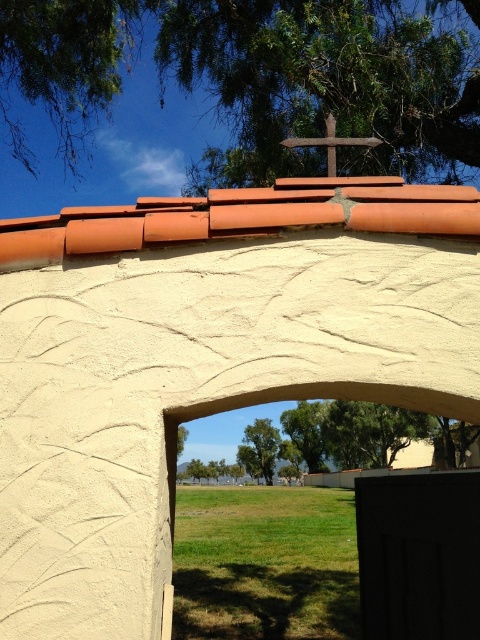
Which of these two, terracotta tiles at upper center or wooden cross at upper center, stands shorter?

wooden cross at upper center is shorter.

Between terracotta tiles at upper center and wooden cross at upper center, which one is positioned lower?

terracotta tiles at upper center

What do you see at coordinates (241, 218) in the screenshot? The height and width of the screenshot is (640, 480). I see `terracotta tiles at upper center` at bounding box center [241, 218].

This screenshot has height=640, width=480. Identify the location of terracotta tiles at upper center. (241, 218).

Measure the distance between smooth stucco arch at upper center and green leafy tree at upper center.

smooth stucco arch at upper center is 5.85 meters from green leafy tree at upper center.

Is the position of smooth stucco arch at upper center less distant than that of green leafy tree at upper center?

Yes.

Between point (158, 312) and point (211, 17), which one is positioned behind?

Point (211, 17)

Locate an element on the screen. The image size is (480, 640). smooth stucco arch at upper center is located at coordinates [x=202, y=362].

Does point (424, 216) come in front of point (269, 481)?

Yes.

Consider the image. Which of these two, terracotta tiles at upper center or green leafy tree at center, stands taller?

green leafy tree at center is taller.

You are a GUI agent. You are given a task and a screenshot of the screen. Output one action in this format:
    pyautogui.click(x=<x>, y=<y>)
    Task: Click on the terracotta tiles at upper center
    This screenshot has height=640, width=480.
    Given the screenshot: What is the action you would take?
    pyautogui.click(x=241, y=218)